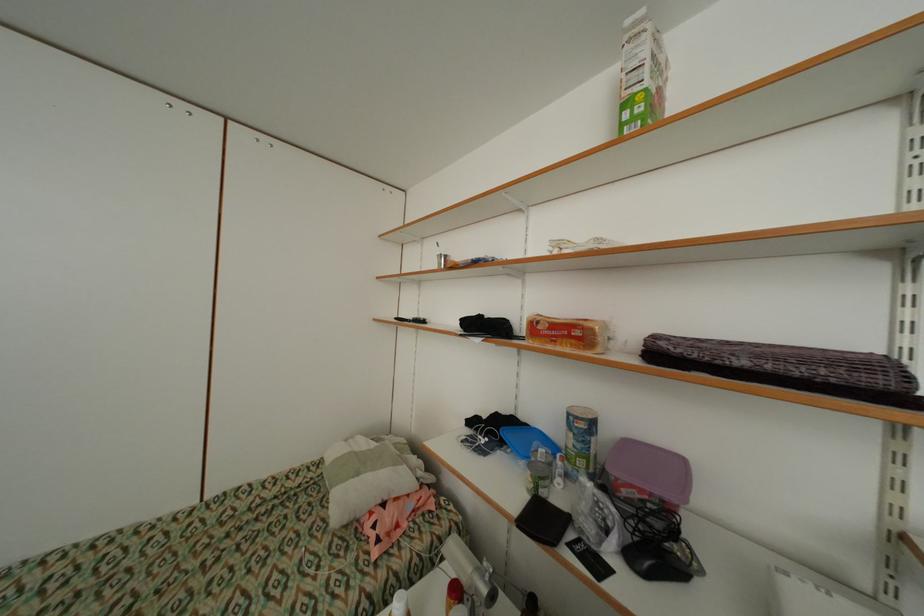
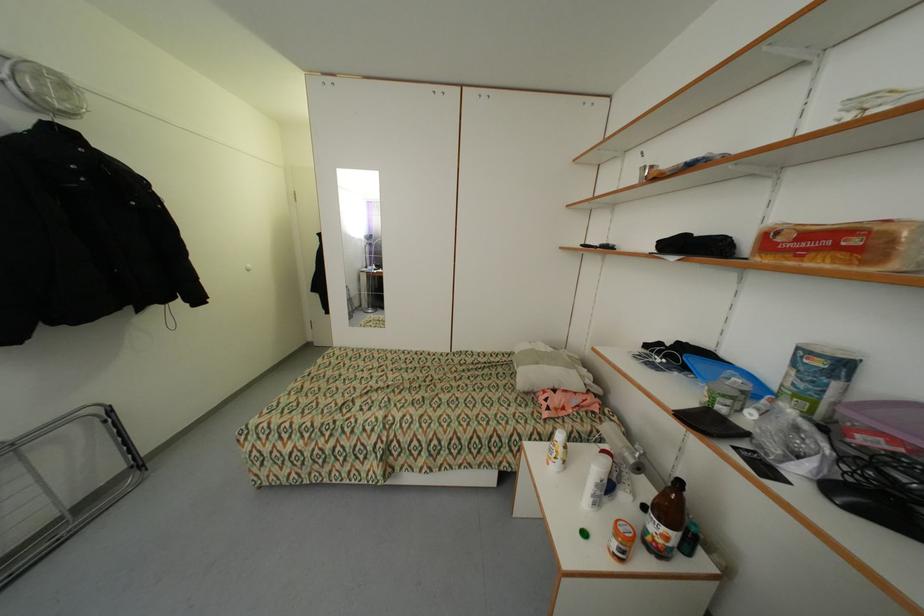
In the second image, find the point that corresponds to point (584, 334) in the first image.

(860, 241)